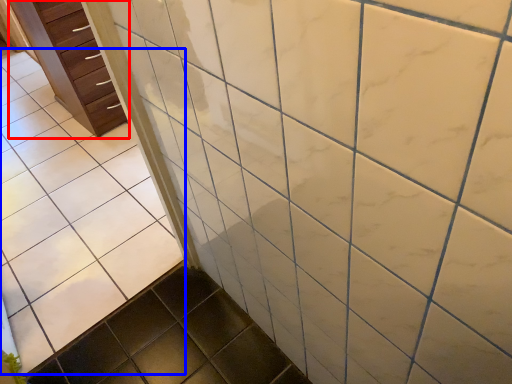
Question: Which object is further to the camera taking this photo, chest of drawers (highlighted by a red box) or ceramic tile (highlighted by a blue box)?

Choices:
 (A) chest of drawers
 (B) ceramic tile

Answer: (A)